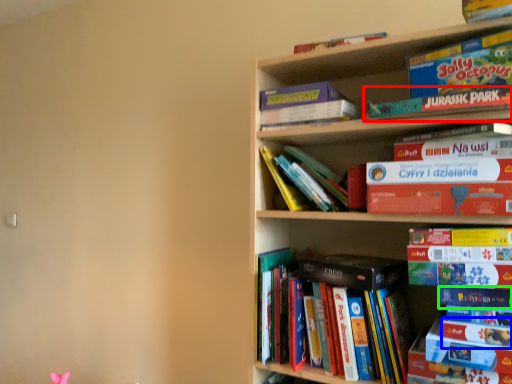
Question: Which object is the closest to the book (highlighted by a red box)? Choose among these: book (highlighted by a blue box) or book (highlighted by a green box).

Choices:
 (A) book
 (B) book

Answer: (B)